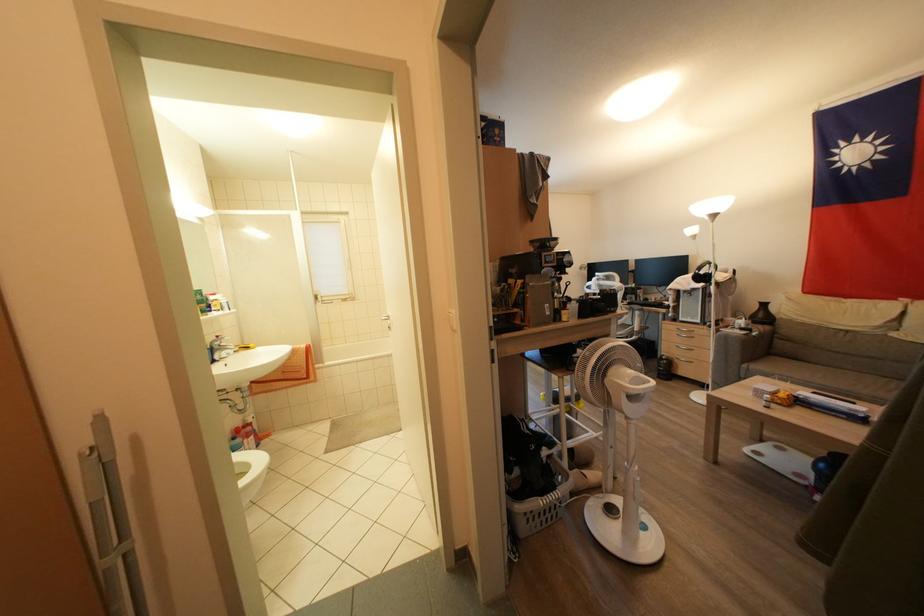
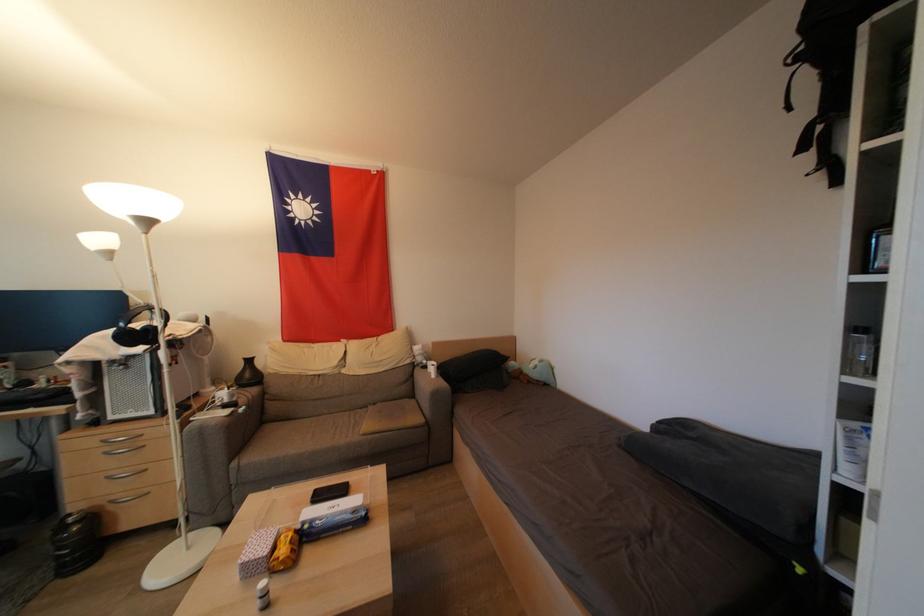
The point at [719,220] is marked in the first image. Where is the corresponding point in the second image?

(152, 225)